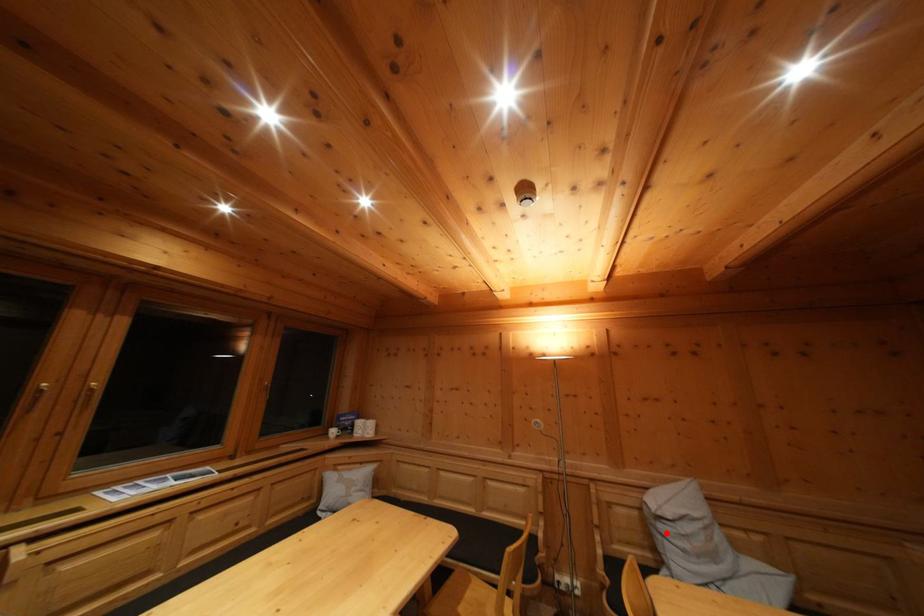
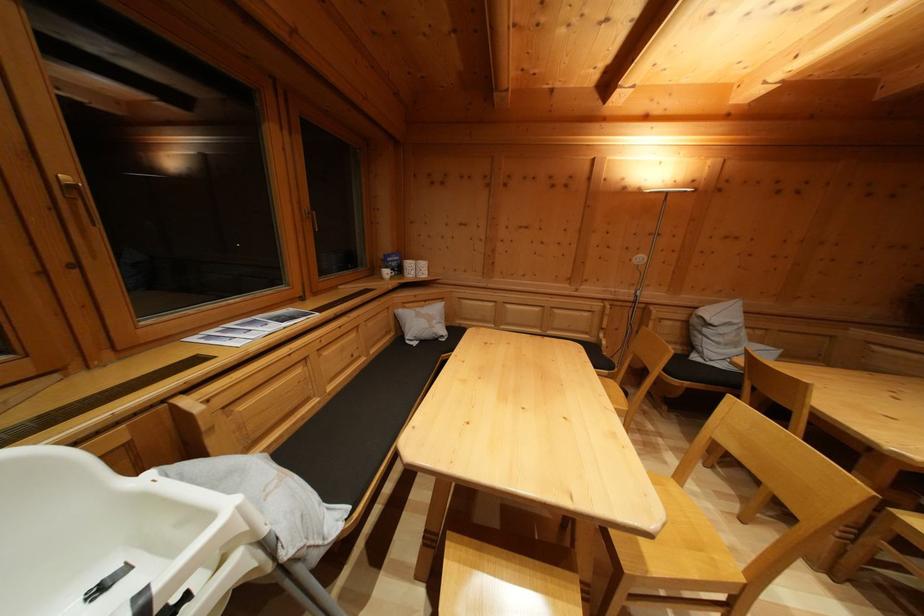
Where in the second image is the point corresponding to the highlighted location from the first image?

(711, 337)